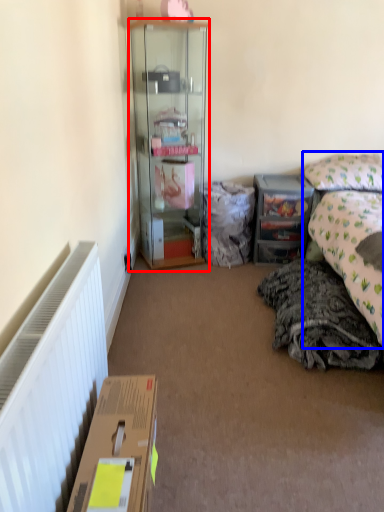
Question: Which object is closer to the camera taking this photo, cabinetry (highlighted by a red box) or bed (highlighted by a blue box)?

Choices:
 (A) cabinetry
 (B) bed

Answer: (B)